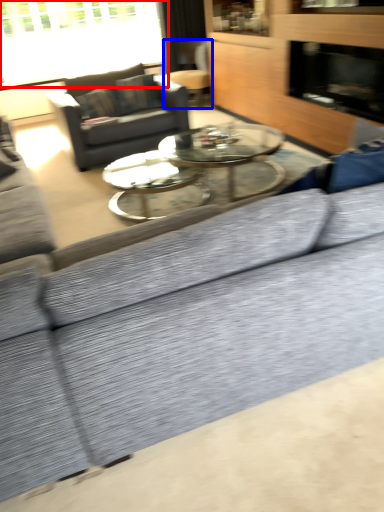
Question: Which point is further to the camera, window (highlighted by a red box) or swivel chair (highlighted by a blue box)?

Choices:
 (A) window
 (B) swivel chair

Answer: (B)